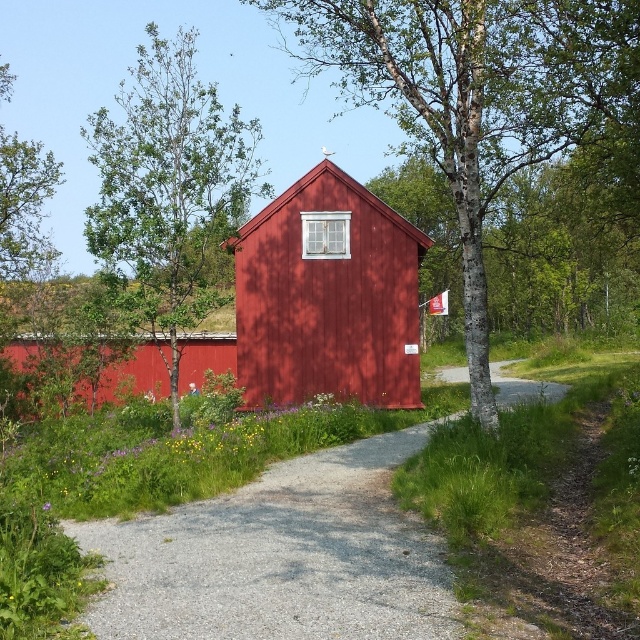
Does bark textured tree at center have a lesser width compared to matte wood hut at center?

No, bark textured tree at center is not thinner than matte wood hut at center.

Can you confirm if bark textured tree at center is taller than matte wood hut at center?

Correct, bark textured tree at center is much taller as matte wood hut at center.

Between point (392, 113) and point (273, 291), which one is positioned in front?

Point (273, 291) is in front.

Locate an element on the screen. This screenshot has width=640, height=640. bark textured tree at center is located at coordinates (486, 100).

Which of these two, matte wood hut at center or green leafy tree at left, stands taller?

With more height is green leafy tree at left.

Measure the distance from matte wood hut at center to green leafy tree at left.

matte wood hut at center and green leafy tree at left are 11.45 meters apart from each other.

Is point (308, 308) in front of point (92, 216)?

No, (308, 308) is further to viewer.

Find the location of `matte wood hut at center`. matte wood hut at center is located at coordinates (326, 296).

Is point (416, 620) in front of point (140, 116)?

Yes, it is in front of point (140, 116).

Between point (413, 541) and point (150, 300), which one is positioned behind?

The point (150, 300) is behind.

Between point (308, 564) and point (195, 195), which one is positioned in front?

Point (308, 564) is in front.

Identify the location of gravel path at center. Image resolution: width=640 pixels, height=640 pixels. (280, 557).